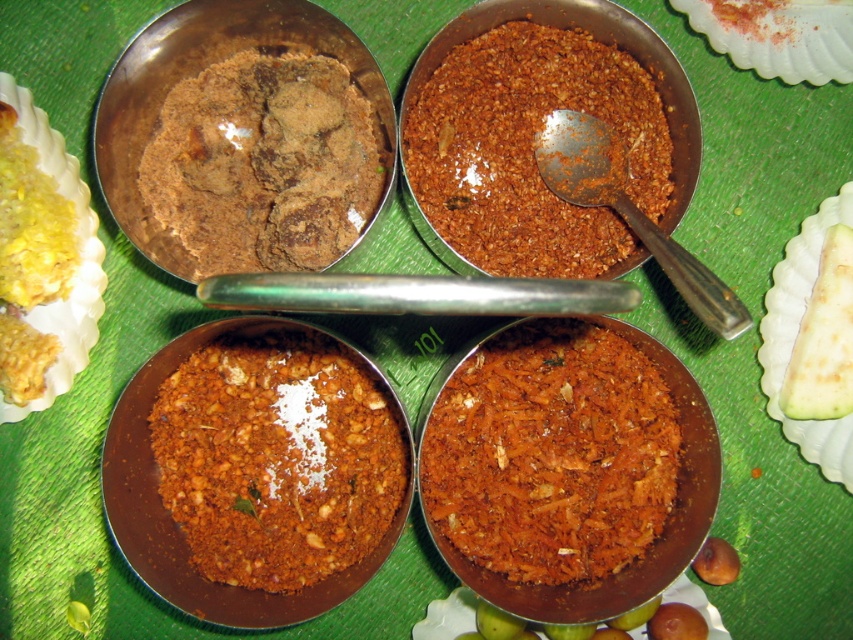
You are a chef preparing a dish and need to use the shiny red powder at bottom right. You are currently standing 5 feet away from it. Can you reach it without moving closer?

The shiny red powder at bottom right is 3.72 feet away from the viewer, so yes, you can reach it without moving closer since it is within your 5 feet distance.

You are a chef preparing a traditional dish and need to use both the shiny red powder at bottom right and the brown matte paste at upper left. Based on their positions, which one is located lower in the image?

The shiny red powder at bottom right is located lower in the image than the brown matte paste at upper left.

What is the color of the object located at point (550, 452)?

The object at point (550, 452) is shiny red powder.